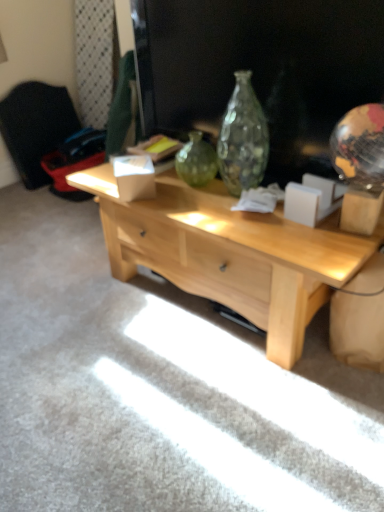
Find the location of a particular element. black fabric armchair at left is located at coordinates (36, 127).

This screenshot has width=384, height=512. What do you see at coordinates (36, 127) in the screenshot? I see `black fabric armchair at left` at bounding box center [36, 127].

What are the coordinates of `light wood desk at center` in the screenshot? It's located at (230, 252).

What is the approximate height of light wood desk at center?

light wood desk at center is 17.94 inches in height.

What do you see at coordinates (230, 252) in the screenshot? I see `light wood desk at center` at bounding box center [230, 252].

Where is `black fabric armchair at left`? This screenshot has width=384, height=512. black fabric armchair at left is located at coordinates tap(36, 127).

Between light wood desk at center and black fabric armchair at left, which one appears on the left side from the viewer's perspective?

black fabric armchair at left is more to the left.

In the scene shown: Does light wood desk at center come behind black fabric armchair at left?

No, it is not.

Considering the positions of point (291, 330) and point (40, 108), is point (291, 330) closer or farther from the camera than point (40, 108)?

Clearly, point (291, 330) is closer to the camera than point (40, 108).

From the image's perspective, which is above, light wood desk at center or black fabric armchair at left?

From the image's view, black fabric armchair at left is above.

From a real-world perspective, is light wood desk at center physically above black fabric armchair at left?

Actually, light wood desk at center is physically below black fabric armchair at left in the real world.

Considering the relative sizes of light wood desk at center and black fabric armchair at left in the image provided, is light wood desk at center thinner than black fabric armchair at left?

In fact, light wood desk at center might be wider than black fabric armchair at left.

Considering the sizes of objects light wood desk at center and black fabric armchair at left in the image provided, who is taller, light wood desk at center or black fabric armchair at left?

Standing taller between the two is black fabric armchair at left.

In the scene shown: Considering the relative sizes of light wood desk at center and black fabric armchair at left in the image provided, is light wood desk at center smaller than black fabric armchair at left?

No, light wood desk at center is not smaller than black fabric armchair at left.

Is light wood desk at center surrounding black fabric armchair at left?

No.

Is light wood desk at center directly adjacent to black fabric armchair at left?

No, light wood desk at center is not with black fabric armchair at left.

Is light wood desk at center turned away from black fabric armchair at left?

light wood desk at center does not have its back to black fabric armchair at left.

Identify the location of desk that appears below the black fabric armchair at left (from a real-world perspective). This screenshot has height=512, width=384. (230, 252).

From the picture: Between black fabric armchair at left and light wood desk at center, which one appears on the right side from the viewer's perspective?

light wood desk at center is more to the right.

Considering their positions, is black fabric armchair at left located in front of or behind light wood desk at center?

In the image, black fabric armchair at left appears behind light wood desk at center.

Which point is more forward, [19,143] or [111,220]?

The point [111,220] is in front.

From the image's perspective, is black fabric armchair at left above light wood desk at center?

Yes, from the image's perspective, black fabric armchair at left is over light wood desk at center.

From a real-world perspective, is black fabric armchair at left located higher than light wood desk at center?

Yes, from a real-world perspective, black fabric armchair at left is on top of light wood desk at center.

From the picture: Considering the sizes of objects black fabric armchair at left and light wood desk at center in the image provided, who is wider, black fabric armchair at left or light wood desk at center?

light wood desk at center.

Which of these two, black fabric armchair at left or light wood desk at center, stands taller?

black fabric armchair at left is taller.

Can you confirm if black fabric armchair at left is smaller than light wood desk at center?

Yes.

Is black fabric armchair at left not within light wood desk at center?

Absolutely, black fabric armchair at left is external to light wood desk at center.

Is black fabric armchair at left next to light wood desk at center and touching it?

black fabric armchair at left is not next to light wood desk at center, and they're not touching.

Is black fabric armchair at left aimed at light wood desk at center?

Yes.

This screenshot has height=512, width=384. Identify the location of armchair lying behind the light wood desk at center. (36, 127).

At what (x,y) coordinates should I click in order to perform the action: click on armchair above the light wood desk at center (from a real-world perspective). Please return your answer as a coordinate pair (x, y). Looking at the image, I should click on (36, 127).

Locate an element on the screen. desk beneath the black fabric armchair at left (from a real-world perspective) is located at coordinates (230, 252).